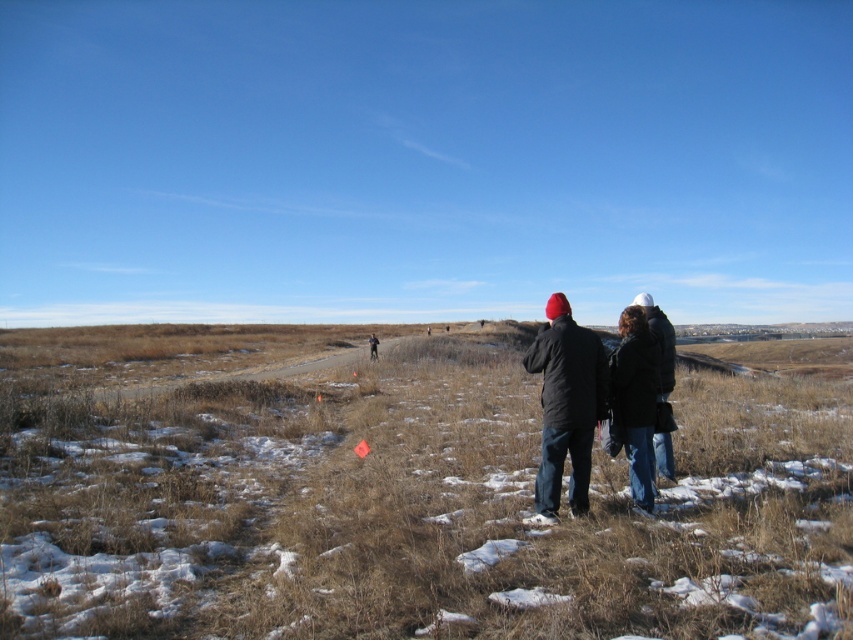
Question: Which object is positioned farthest from the dark gray jacket at center?

Choices:
 (A) black matte jackets at center
 (B) dry grass at lower center

Answer: (B)

Question: Is dry grass at lower center smaller than black matte jackets at center?

Choices:
 (A) yes
 (B) no

Answer: (B)

Question: Considering the relative positions of dry grass at lower center and dark gray jacket at center in the image provided, where is dry grass at lower center located with respect to dark gray jacket at center?

Choices:
 (A) above
 (B) below

Answer: (B)

Question: Among these objects, which one is farthest from the camera?

Choices:
 (A) black matte jackets at center
 (B) dark gray jacket at center
 (C) dark blue jeans at center
 (D) dry grass at lower center

Answer: (B)

Question: Which object is positioned closest to the black matte jackets at center?

Choices:
 (A) dark blue jeans at center
 (B) dry grass at lower center

Answer: (A)

Question: Is dry grass at lower center further to the viewer compared to dark blue jeans at center?

Choices:
 (A) yes
 (B) no

Answer: (B)